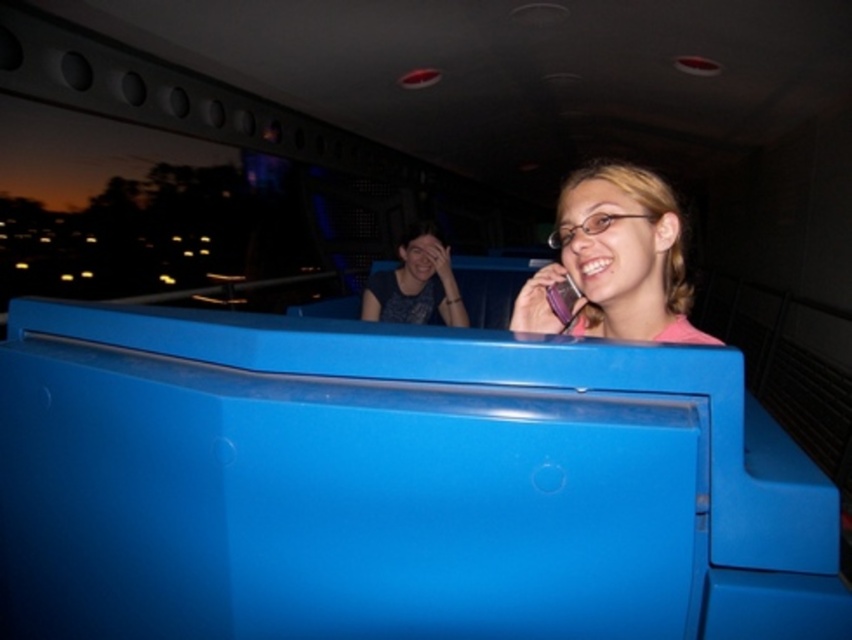
You are a photographer taking a picture of the scene. The pink matte phone at upper right and the matte black shirt at center are both in the frame. Which object is positioned lower in the image?

The pink matte phone at upper right is positioned below the matte black shirt at center, so it is lower in the image.

You are trying to decide which phone to take with you on a trip. Both the pink matte phone at upper right and the matte purple phone at upper right are available. Considering their sizes, which one would you choose if you prefer a wider phone?

The pink matte phone at upper right is wider than the matte purple phone at upper right, so you should choose the pink matte phone at upper right if you prefer a wider phone.

You are trying to decide whether to place a new accessory on the pink matte phone at upper right or the matte black shirt at center. Which object would be more suitable if the accessory requires a larger surface area?

The matte black shirt at center is larger than the pink matte phone at upper right, so it would be more suitable for an accessory requiring a larger surface area.